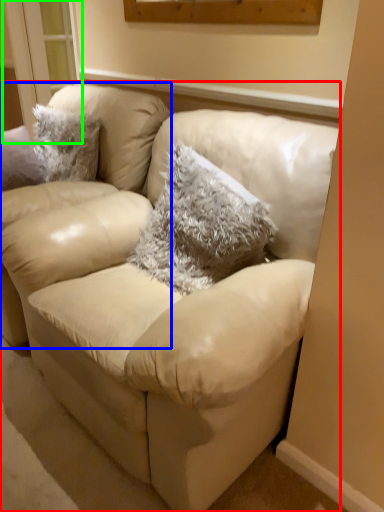
Question: Based on their relative distances, which object is nearer to studio couch (highlighted by a red box)? Choose from chair (highlighted by a blue box) and window (highlighted by a green box).

Choices:
 (A) chair
 (B) window

Answer: (A)